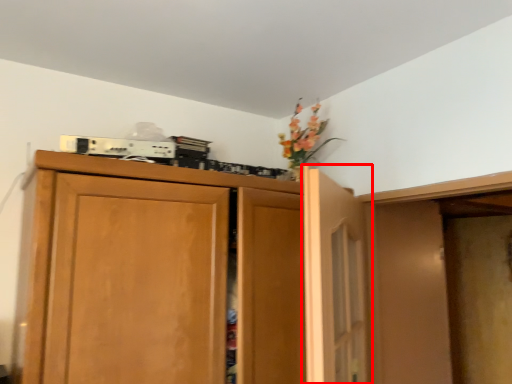
Question: From the image, what is the correct spatial relationship of door (annotated by the red box) in relation to cupboard?

Choices:
 (A) left
 (B) right

Answer: (B)